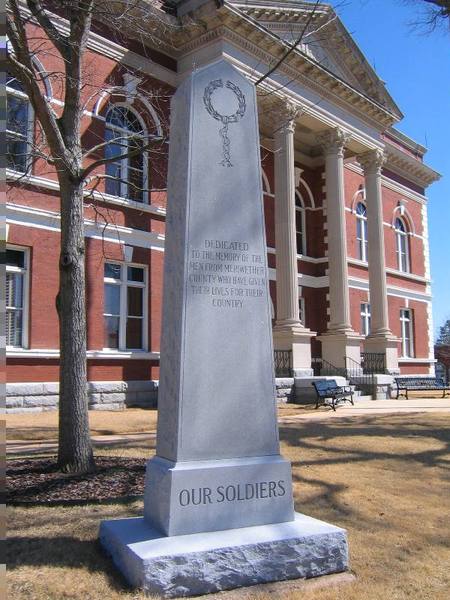
Find the location of a particular element. The width and height of the screenshot is (450, 600). staircase is located at coordinates (363, 391).